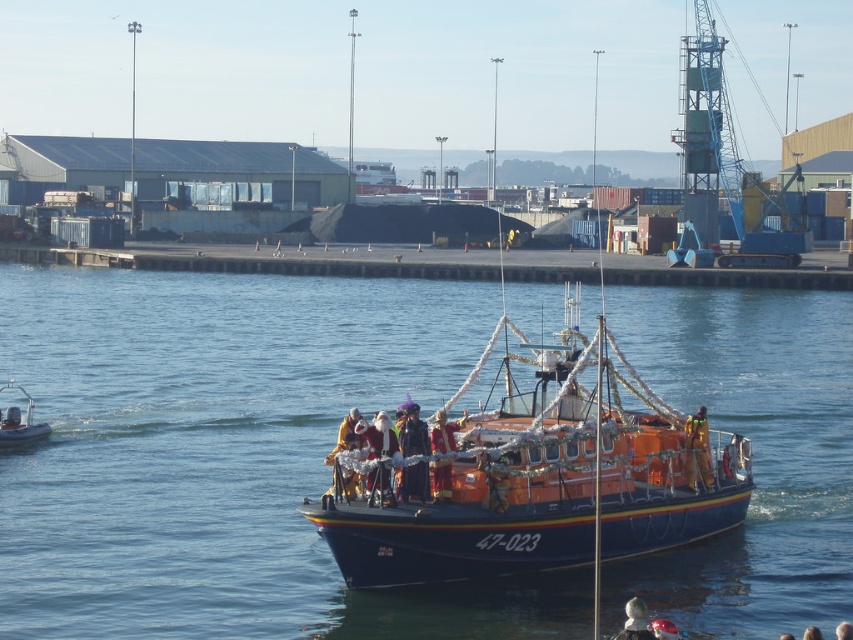
Question: Which object is closer to the camera taking this photo?

Choices:
 (A) velvet-like santa suit at center
 (B) white fabric hat at center
 (C) blue water at center
 (D) santa claus costume at center

Answer: (B)

Question: Which point is farther from the camera taking this photo?

Choices:
 (A) (679, 356)
 (B) (453, 449)
 (C) (688, 467)

Answer: (A)

Question: Which point is farther from the camera taking this photo?

Choices:
 (A) (396, 452)
 (B) (251, 376)

Answer: (B)

Question: Does santa claus costume at center have a smaller size compared to orange fabric santa at center?

Choices:
 (A) yes
 (B) no

Answer: (A)

Question: Can you confirm if velvet-like santa suit at center is positioned to the left of orange fabric santa at center?

Choices:
 (A) no
 (B) yes

Answer: (B)

Question: Is orange fiberglass boat at center further to the viewer compared to santa claus costume at center?

Choices:
 (A) yes
 (B) no

Answer: (B)